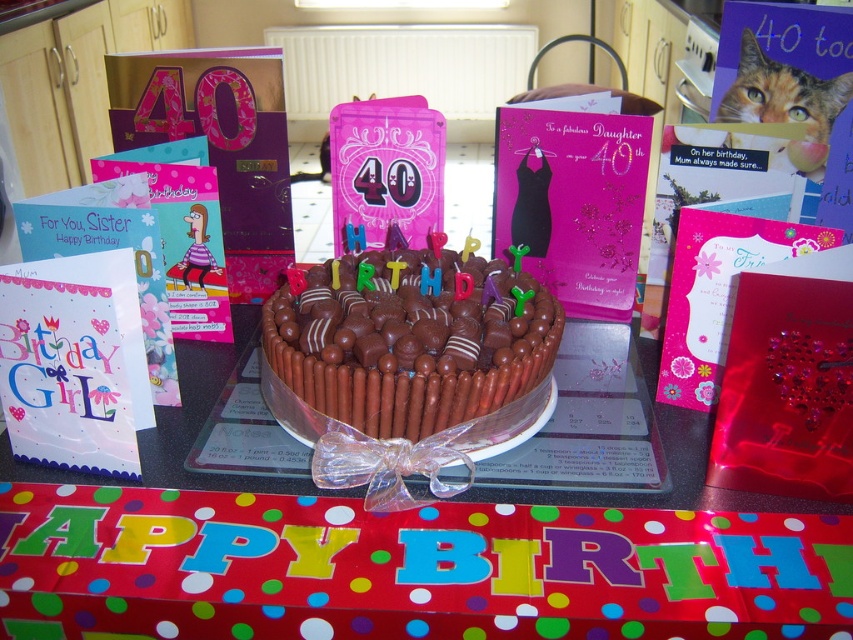
Question: Which point appears farthest from the camera in this image?

Choices:
 (A) (165, 400)
 (B) (202, 236)

Answer: (B)

Question: Is pink paper card at center below matte pink card at left?

Choices:
 (A) yes
 (B) no

Answer: (B)

Question: Does matte white card with pink accents at lower left appear on the left side of matte pink card at left?

Choices:
 (A) no
 (B) yes

Answer: (B)

Question: Among these objects, which one is farthest from the camera?

Choices:
 (A) pink glittery dress at center
 (B) white paper card at left

Answer: (A)

Question: Among these objects, which one is nearest to the camera?

Choices:
 (A) pink glittery dress at center
 (B) matte white card with pink accents at lower left
 (C) pink glittery card at center

Answer: (B)

Question: Is chocolate cake at center to the right of chocolatesmoothcake at center from the viewer's perspective?

Choices:
 (A) no
 (B) yes

Answer: (A)